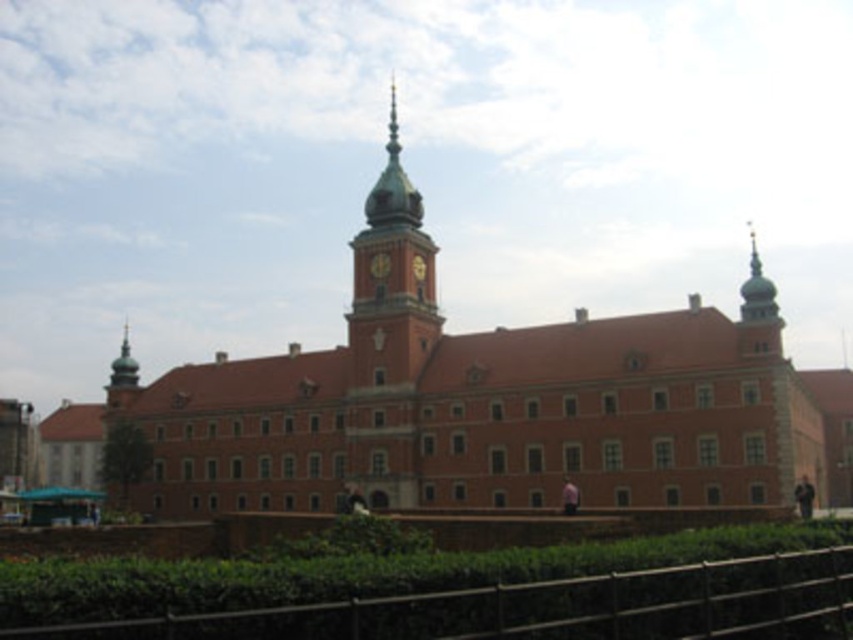
You are standing in front of the historic building and notice two clocks. One is labeled as the gold metallic clock at center and the other as the golden metallic clock at center. Which one is positioned to the left?

The gold metallic clock at center is positioned to the left of the golden metallic clock at center.

Looking at this image, you are a visitor standing at the entrance of the historic building and want to take a photo that includes both the brown wooden fence at lower center and the golden metallic clock at center. Considering their sizes, which object should you position closer to the camera to ensure both are visible in the frame?

Since the brown wooden fence at lower center is larger than the golden metallic clock at center, you should position the golden metallic clock at center closer to the camera to balance their sizes in the photo.